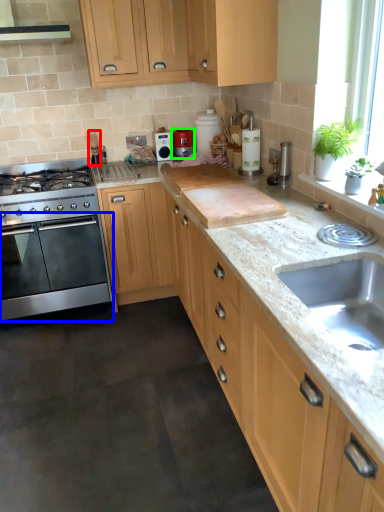
Question: Considering the real-world distances, which object is closest to appliance (highlighted by a red box)? oven (highlighted by a blue box) or kitchen appliance (highlighted by a green box).

Choices:
 (A) oven
 (B) kitchen appliance

Answer: (B)